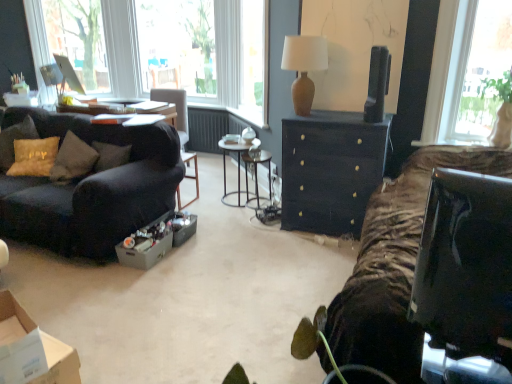
Locate an element on the screen. The image size is (512, 384). vacant space underneath black glossy television at upper right (from a real-world perspective) is located at coordinates coord(371,127).